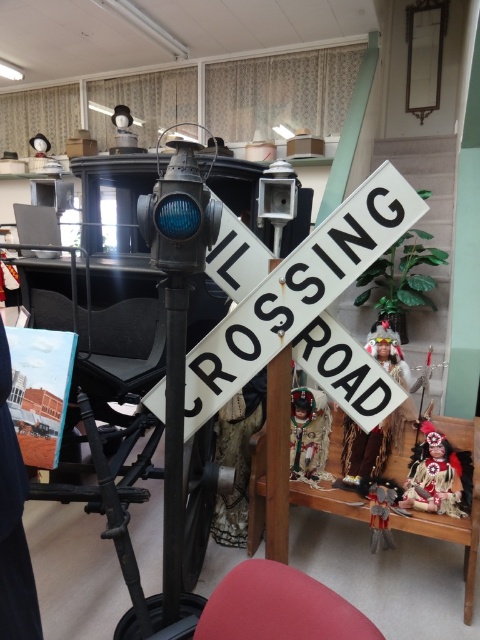
You are an interior designer planning to place a new sculpture between the black metal pole at center and the matte red doll at lower right. Based on their sizes, which object should the sculpture be placed closer to?

The sculpture should be placed closer to the matte red doll at lower right because the black metal pole at center is thinner than the matte red doll at lower right, meaning the doll is wider and requires more space between objects.

You are an interior designer assessing the layout of this museum exhibit. You need to determine if the white matte railroad crossing sign at center can be seen over the top of the black metal pole at center from the main viewing area. Based on their heights, what is your assessment?

The white matte railroad crossing sign at center has a lesser height compared to the black metal pole at center, so it cannot be seen over the top of the black metal pole at center from the main viewing area.